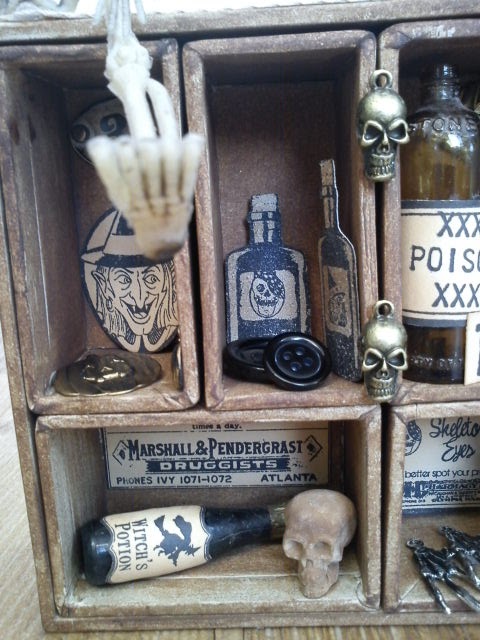
What are the coordinates of `small skull in cubby` in the screenshot? It's located at (324, 524).